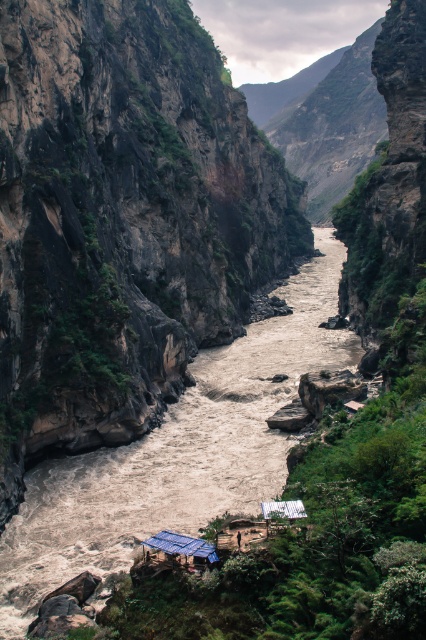
You are a hiker who wants to cross the river at the center of the canyon. You see the brown muddy water at center and the white corrugated metal hut at center. Which object is positioned to the right of the other?

The brown muddy water at center is to the right of the white corrugated metal hut at center.

What is the exact coordinate of the brown muddy water at center?

The brown muddy water at center is located at point (178, 452).

You are a hiker planning to cross the river using a narrow path that runs along the riverbank. The blue corrugated metal hut at center is your destination. If the path is only 2 meters wide, can you safely navigate around the large boulders blocking part of the path?

The path is only 2 meters wide, but the blue corrugated metal hut at center is 38.22 meters away. Since the distance is much greater than the path width, you can navigate around the boulders as long as there is enough space along the path to maneuver. However, the presence of large boulders may require careful planning to ensure safe passage.